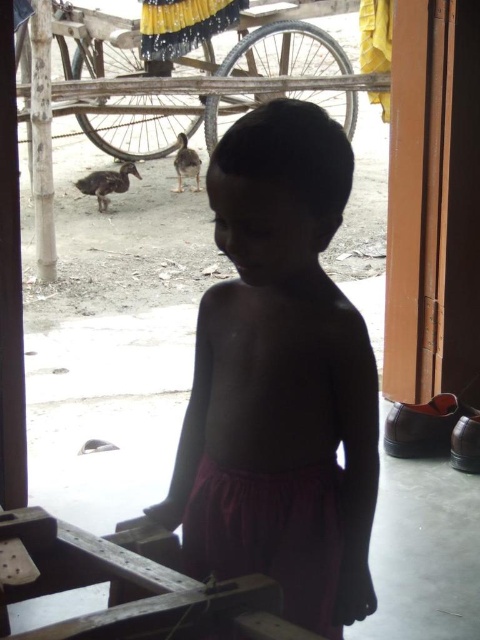
Who is positioned more to the right, matte purple skirt at center or brown fuzzy duckling at center?

matte purple skirt at center is more to the right.

Describe the element at coordinates (269, 536) in the screenshot. I see `matte purple skirt at center` at that location.

Identify the location of matte purple skirt at center. (269, 536).

The height and width of the screenshot is (640, 480). What do you see at coordinates (107, 182) in the screenshot?
I see `brown matte duck at lower left` at bounding box center [107, 182].

The width and height of the screenshot is (480, 640). What are the coordinates of `brown matte duck at lower left` in the screenshot? It's located at (107, 182).

Does dark skin/smooth skin/child at center have a lesser height compared to matte purple skirt at center?

No.

Is point (299, 360) farther from viewer compared to point (272, 504)?

No, it is in front of (272, 504).

Is point (213, 156) in front of point (230, 474)?

That is True.

At what (x,y) coordinates should I click in order to perform the action: click on dark skin/smooth skin/child at center. Please return your answer as a coordinate pair (x, y). The width and height of the screenshot is (480, 640). Looking at the image, I should click on (279, 376).